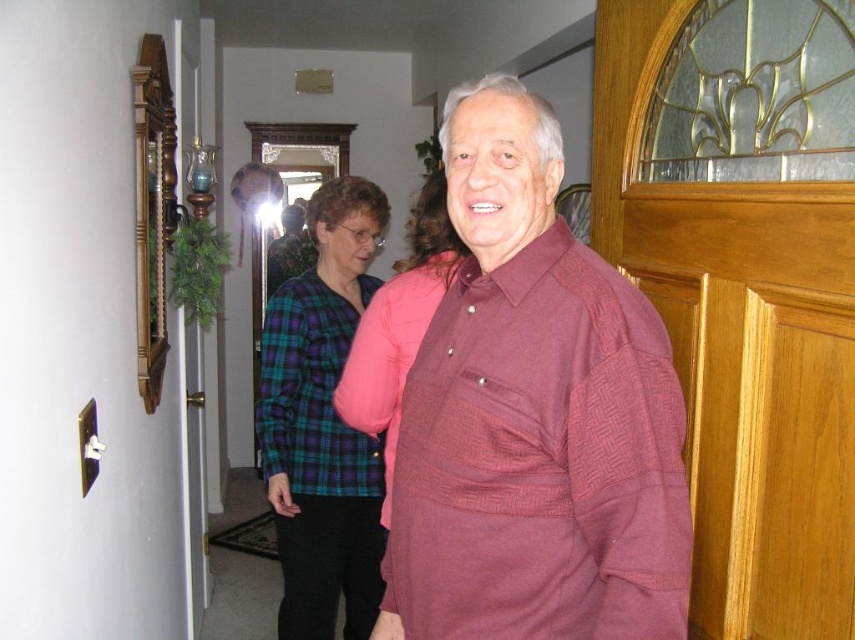
You are standing in the hallway and want to take a photo of the maroon woven shirt at center. The mirror on the left wall is reflecting part of the hallway. Where should you position yourself to ensure the shirt is fully visible in the mirror?

To ensure the maroon woven shirt at center is fully visible in the mirror, position yourself so that the shirt is within the reflective area of the mirror. Since the mirror is on the left wall, stand in a spot where the shirt at point (x=534, y=417) is reflected by the mirror. Adjust your angle so the mirror captures the shirt without obstruction.